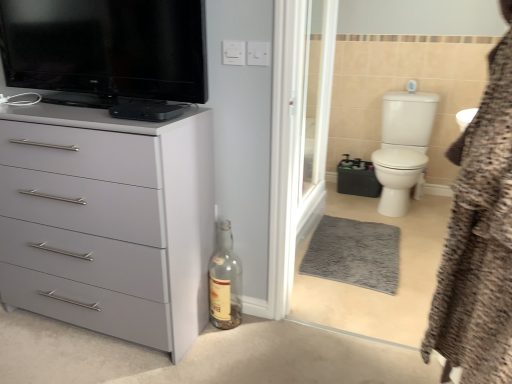
This screenshot has height=384, width=512. Find the location of `brown textured bathrobe at right`. brown textured bathrobe at right is located at coordinates (479, 238).

Considering the relative positions of transparent glass screen door at center and brown textured bathrobe at right in the image provided, is transparent glass screen door at center to the right of brown textured bathrobe at right from the viewer's perspective?

In fact, transparent glass screen door at center is to the left of brown textured bathrobe at right.

Who is shorter, transparent glass screen door at center or brown textured bathrobe at right?

Standing shorter between the two is brown textured bathrobe at right.

Between transparent glass screen door at center and brown textured bathrobe at right, which one has larger size?

brown textured bathrobe at right is bigger.

From the image's perspective, which object appears higher, clear glass bottle at lower center or brown textured bathrobe at right?

brown textured bathrobe at right is shown above in the image.

How many degrees apart are the facing directions of clear glass bottle at lower center and brown textured bathrobe at right?

63.5 degrees separate the facing orientations of clear glass bottle at lower center and brown textured bathrobe at right.

Is there a large distance between clear glass bottle at lower center and brown textured bathrobe at right?

No.

Is clear glass bottle at lower center directly adjacent to black glossy television at upper left?

No, clear glass bottle at lower center is not beside black glossy television at upper left.

Is clear glass bottle at lower center smaller than black glossy television at upper left?

Yes, clear glass bottle at lower center is smaller than black glossy television at upper left.

Would you say clear glass bottle at lower center is to the left or to the right of black glossy television at upper left in the picture?

Based on their positions, clear glass bottle at lower center is located to the right of black glossy television at upper left.

Is clear glass bottle at lower center looking in the opposite direction of black glossy television at upper left?

clear glass bottle at lower center does not have its back to black glossy television at upper left.

You are a GUI agent. You are given a task and a screenshot of the screen. Output one action in this format:
    pyautogui.click(x=<x>, y=<y>)
    Task: Click on the television that is on the left side of transparent glass screen door at center
    This screenshot has width=512, height=384.
    Given the screenshot: What is the action you would take?
    pyautogui.click(x=106, y=47)

Relative to transparent glass screen door at center, is black glossy television at upper left in front or behind?

In the image, black glossy television at upper left appears in front of transparent glass screen door at center.

Based on their sizes in the image, would you say black glossy television at upper left is bigger or smaller than transparent glass screen door at center?

Clearly, black glossy television at upper left is smaller in size than transparent glass screen door at center.

Considering the relative positions of black glossy television at upper left and transparent glass screen door at center in the image provided, is black glossy television at upper left to the right of transparent glass screen door at center from the viewer's perspective?

No.

Can you confirm if matte gray chest of drawers at left is wider than transparent glass screen door at center?

Correct, the width of matte gray chest of drawers at left exceeds that of transparent glass screen door at center.

Who is taller, matte gray chest of drawers at left or transparent glass screen door at center?

With more height is transparent glass screen door at center.

Is matte gray chest of drawers at left outside of transparent glass screen door at center?

Indeed, matte gray chest of drawers at left is completely outside transparent glass screen door at center.

In the scene shown: How far apart are matte gray chest of drawers at left and transparent glass screen door at center?

The distance of matte gray chest of drawers at left from transparent glass screen door at center is 4.15 feet.

How different are the orientations of brown textured bathrobe at right and transparent glass screen door at center in degrees?

154 degrees separate the facing orientations of brown textured bathrobe at right and transparent glass screen door at center.

Find the location of a particular element. bathrobe that is above the transparent glass screen door at center (from a real-world perspective) is located at coordinates (479, 238).

Considering the relative positions of brown textured bathrobe at right and transparent glass screen door at center in the image provided, is brown textured bathrobe at right to the right of transparent glass screen door at center from the viewer's perspective?

Yes, brown textured bathrobe at right is to the right of transparent glass screen door at center.

Considering the positions of objects brown textured bathrobe at right and transparent glass screen door at center in the image provided, who is behind, brown textured bathrobe at right or transparent glass screen door at center?

transparent glass screen door at center is behind.

Is brown textured bathrobe at right wider or thinner than clear glass bottle at lower center?

brown textured bathrobe at right is wider than clear glass bottle at lower center.

Are brown textured bathrobe at right and clear glass bottle at lower center located far from each other?

No, brown textured bathrobe at right is in close proximity to clear glass bottle at lower center.

Between brown textured bathrobe at right and clear glass bottle at lower center, which one has larger size?

brown textured bathrobe at right.

You are a GUI agent. You are given a task and a screenshot of the screen. Output one action in this format:
    pyautogui.click(x=<x>, y=<y>)
    Task: Click on the screen door located above the brown textured bathrobe at right (from the image's perspective)
    The height and width of the screenshot is (384, 512).
    Given the screenshot: What is the action you would take?
    pyautogui.click(x=315, y=110)

Image resolution: width=512 pixels, height=384 pixels. Find the location of `bathrobe lying on the right of clear glass bottle at lower center`. bathrobe lying on the right of clear glass bottle at lower center is located at coordinates (479, 238).

Based on their spatial positions, is white glossy toilet bowl at right or matte gray chest of drawers at left closer to brown textured bathrobe at right?

The object closer to brown textured bathrobe at right is matte gray chest of drawers at left.

Based on their spatial positions, is transparent glass screen door at center or white glossy toilet bowl at right closer to brown textured bathrobe at right?

transparent glass screen door at center is closer to brown textured bathrobe at right.

Considering their positions, is brown textured bathrobe at right positioned further to white glossy toilet bowl at right than matte gray chest of drawers at left?

matte gray chest of drawers at left is further to white glossy toilet bowl at right.

Based on their spatial positions, is white glossy toilet bowl at right or transparent glass screen door at center closer to black glossy television at upper left?

transparent glass screen door at center lies closer to black glossy television at upper left than the other object.

Estimate the real-world distances between objects in this image. Which object is closer to transparent glass screen door at center, brown textured bathrobe at right or white glossy toilet bowl at right?

Among the two, white glossy toilet bowl at right is located nearer to transparent glass screen door at center.

From the image, which object appears to be nearer to matte gray chest of drawers at left, clear glass bottle at lower center or transparent glass screen door at center?

clear glass bottle at lower center is closer to matte gray chest of drawers at left.

In the scene shown: Looking at the image, which one is located further to black glossy television at upper left, clear glass bottle at lower center or transparent glass screen door at center?

transparent glass screen door at center is further to black glossy television at upper left.

From the image, which object appears to be farther from clear glass bottle at lower center, white glossy toilet bowl at right or transparent glass screen door at center?

white glossy toilet bowl at right is further to clear glass bottle at lower center.

At what (x,y) coordinates should I click in order to perform the action: click on bottle between matte gray chest of drawers at left and transparent glass screen door at center from left to right. Please return your answer as a coordinate pair (x, y). This screenshot has width=512, height=384. Looking at the image, I should click on (225, 282).

Find the location of a particular element. This screenshot has width=512, height=384. television between brown textured bathrobe at right and white glossy toilet bowl at right from front to back is located at coordinates (106, 47).

The image size is (512, 384). Find the location of `the chest of drawers located between brown textured bathrobe at right and white glossy toilet bowl at right in the depth direction`. the chest of drawers located between brown textured bathrobe at right and white glossy toilet bowl at right in the depth direction is located at coordinates (108, 221).

Find the location of `bottle between matte gray chest of drawers at left and brown textured bathrobe at right in the horizontal direction`. bottle between matte gray chest of drawers at left and brown textured bathrobe at right in the horizontal direction is located at coordinates (225, 282).